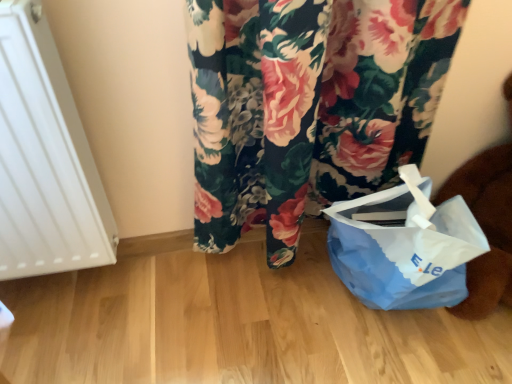
What do you see at coordinates (45, 158) in the screenshot? The height and width of the screenshot is (384, 512). I see `white matte radiator at left` at bounding box center [45, 158].

This screenshot has width=512, height=384. I want to click on white matte radiator at left, so click(x=45, y=158).

What do you see at coordinates (404, 246) in the screenshot?
I see `blue paper bag at lower right` at bounding box center [404, 246].

At what (x,y) coordinates should I click in order to perform the action: click on blue paper bag at lower right. Please return your answer as a coordinate pair (x, y). Looking at the image, I should click on (404, 246).

The width and height of the screenshot is (512, 384). What are the coordinates of `white matte radiator at left` in the screenshot? It's located at (45, 158).

Based on their positions, is white matte radiator at left located to the left or right of blue paper bag at lower right?

white matte radiator at left is to the left of blue paper bag at lower right.

Is white matte radiator at left further to camera compared to blue paper bag at lower right?

That is False.

Considering the points (6, 119) and (410, 212), which point is behind, point (6, 119) or point (410, 212)?

Positioned behind is point (410, 212).

From the image's perspective, relative to blue paper bag at lower right, is white matte radiator at left above or below?

Based on their image positions, white matte radiator at left is located above blue paper bag at lower right.

From a real-world perspective, is white matte radiator at left positioned over blue paper bag at lower right based on gravity?

Indeed, from a real-world perspective, white matte radiator at left stands above blue paper bag at lower right.

Which object is wider, white matte radiator at left or blue paper bag at lower right?

With larger width is blue paper bag at lower right.

Considering the relative sizes of white matte radiator at left and blue paper bag at lower right in the image provided, is white matte radiator at left taller than blue paper bag at lower right?

Indeed, white matte radiator at left has a greater height compared to blue paper bag at lower right.

Which of these two, white matte radiator at left or blue paper bag at lower right, is smaller?

white matte radiator at left is smaller.

Is white matte radiator at left inside the boundaries of blue paper bag at lower right, or outside?

white matte radiator at left is outside blue paper bag at lower right.

Is there a large distance between white matte radiator at left and blue paper bag at lower right?

That's not correct — white matte radiator at left is a little close to blue paper bag at lower right.

Is blue paper bag at lower right at the back of white matte radiator at left?

white matte radiator at left does not have its back to blue paper bag at lower right.

This screenshot has height=384, width=512. What are the coordinates of `plastic bag on the right of the white matte radiator at left` in the screenshot? It's located at (404, 246).

Which is more to the left, blue paper bag at lower right or white matte radiator at left?

white matte radiator at left.

Relative to white matte radiator at left, is blue paper bag at lower right in front or behind?

Answer: blue paper bag at lower right is behind white matte radiator at left.

Does point (421, 184) appear closer or farther from the camera than point (32, 163)?

Point (421, 184) is positioned farther from the camera compared to point (32, 163).

Looking at this image, from the image's perspective, who appears lower, blue paper bag at lower right or white matte radiator at left?

blue paper bag at lower right.

From a real-world perspective, between blue paper bag at lower right and white matte radiator at left, who is vertically higher?

From a 3D spatial view, white matte radiator at left is above.

Considering the sizes of blue paper bag at lower right and white matte radiator at left in the image, is blue paper bag at lower right wider or thinner than white matte radiator at left?

Considering their sizes, blue paper bag at lower right looks broader than white matte radiator at left.

Between blue paper bag at lower right and white matte radiator at left, which one has less height?

blue paper bag at lower right is shorter.

Based on their sizes in the image, would you say blue paper bag at lower right is bigger or smaller than white matte radiator at left?

Considering their sizes, blue paper bag at lower right takes up more space than white matte radiator at left.

Would you say blue paper bag at lower right is outside white matte radiator at left?

Yes, blue paper bag at lower right is outside of white matte radiator at left.

Is blue paper bag at lower right touching white matte radiator at left?

They are not placed beside each other.

Is white matte radiator at left at the back of blue paper bag at lower right?

No, white matte radiator at left is not at the back of blue paper bag at lower right.

In order to click on radiator on the left of blue paper bag at lower right in this screenshot , I will do `click(45, 158)`.

Locate an element on the screen. The image size is (512, 384). plastic bag below the white matte radiator at left (from a real-world perspective) is located at coordinates (404, 246).

Identify the location of radiator that is above the blue paper bag at lower right (from the image's perspective). (45, 158).